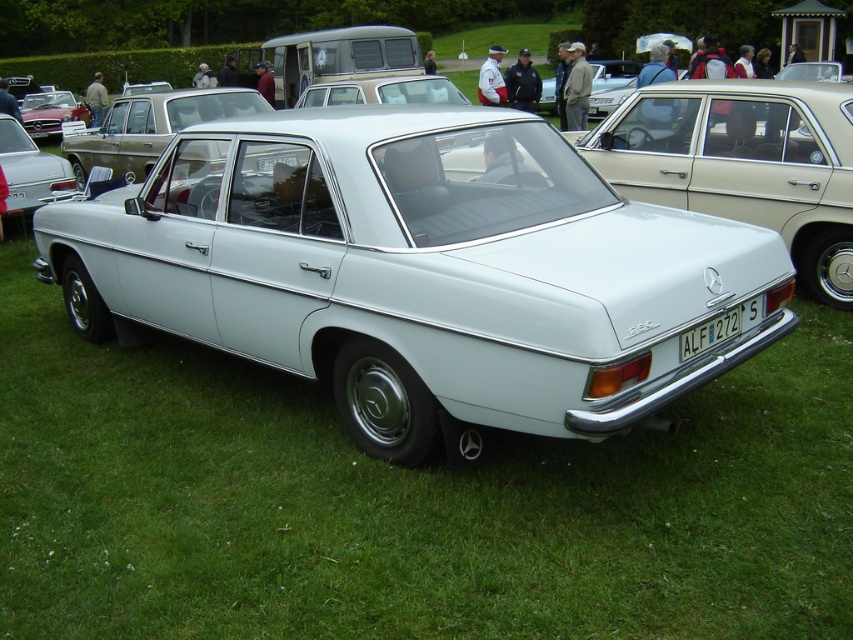
Question: Which point appears farthest from the camera in this image?

Choices:
 (A) (28, 131)
 (B) (689, 344)

Answer: (A)

Question: Can you confirm if metallic red convertible at upper left is smaller than white plastic license plate at center?

Choices:
 (A) no
 (B) yes

Answer: (A)

Question: Does metallic red convertible at upper left have a larger size compared to white plastic license plate at center?

Choices:
 (A) yes
 (B) no

Answer: (A)

Question: Can you confirm if metallic red convertible at upper left is smaller than white plastic license plate at center?

Choices:
 (A) yes
 (B) no

Answer: (B)

Question: Which point is closer to the camera?

Choices:
 (A) white plastic license plate at center
 (B) metallic red convertible at upper left

Answer: (A)